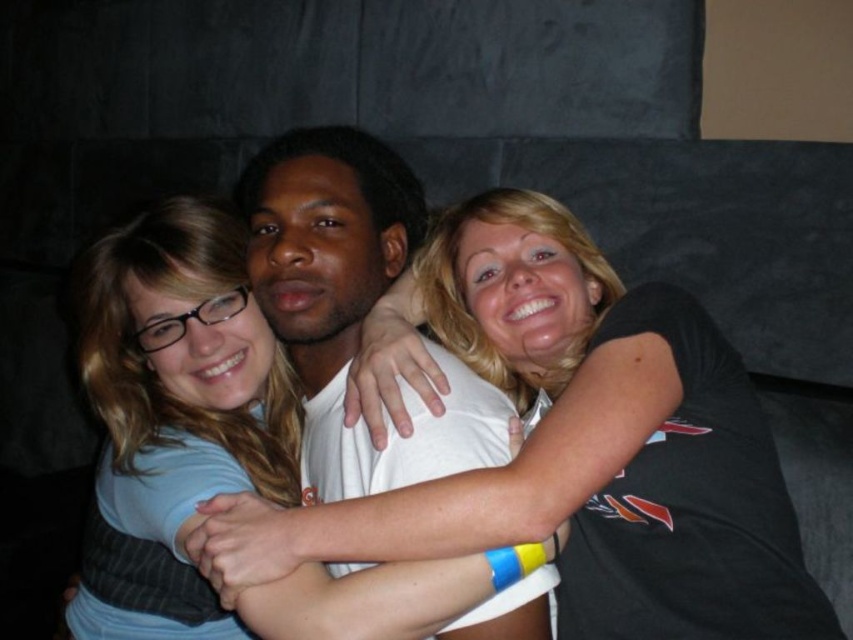
Question: Which point is closer to the camera?

Choices:
 (A) (225, 557)
 (B) (213, 372)

Answer: (A)

Question: Is black matte t-shirt at center to the right of light blue fabric shirt at center from the viewer's perspective?

Choices:
 (A) yes
 (B) no

Answer: (A)

Question: Does black matte t-shirt at center appear on the left side of light blue fabric shirt at center?

Choices:
 (A) no
 (B) yes

Answer: (A)

Question: Which object appears farthest from the camera in this image?

Choices:
 (A) matte blue shirt at center
 (B) black matte t-shirt at center
 (C) light blue fabric shirt at center

Answer: (A)

Question: Can you confirm if black matte t-shirt at center is positioned to the right of light blue fabric shirt at center?

Choices:
 (A) yes
 (B) no

Answer: (A)

Question: Which object is farther from the camera taking this photo?

Choices:
 (A) black matte t-shirt at center
 (B) matte blue shirt at center

Answer: (B)